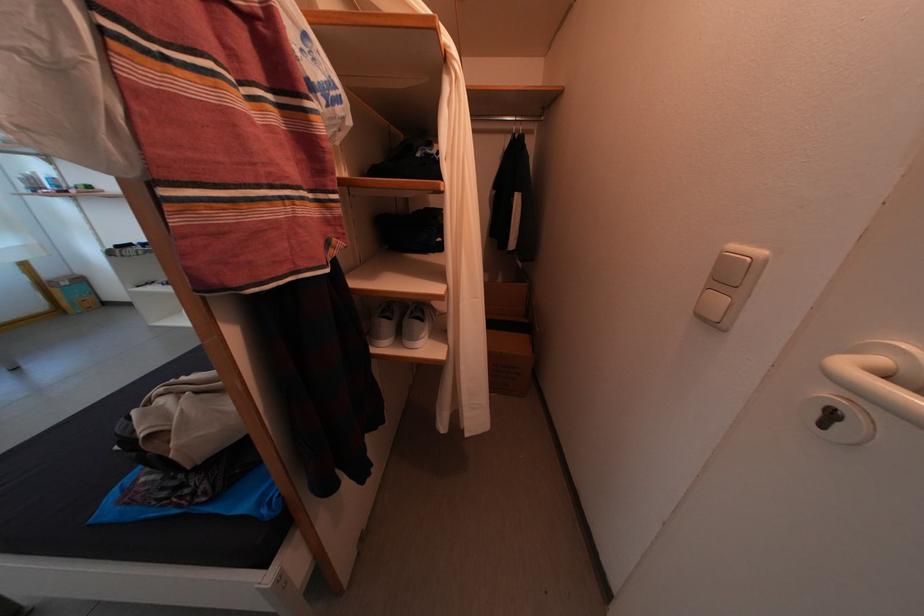
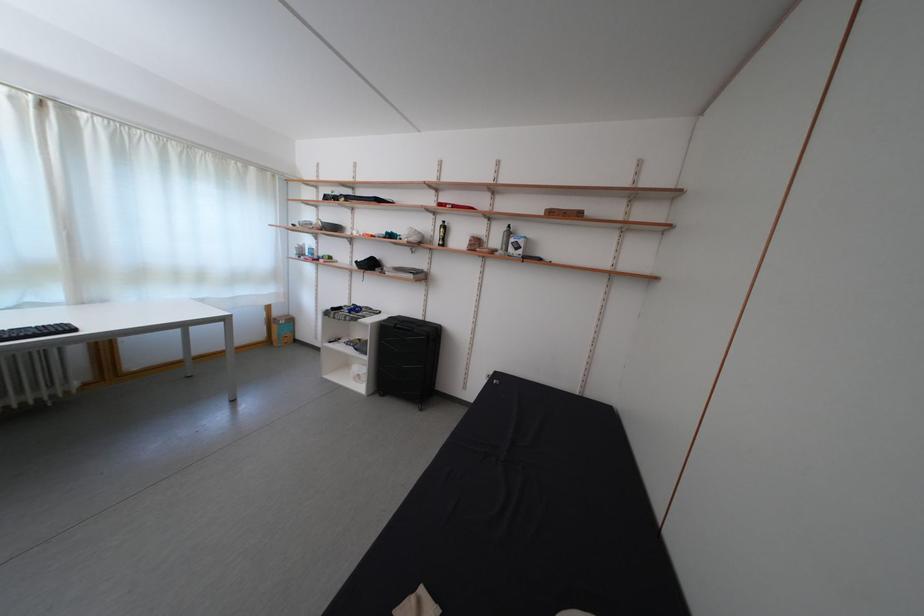
In the second image, find the point that corresponds to (x=55, y=281) in the first image.

(285, 320)